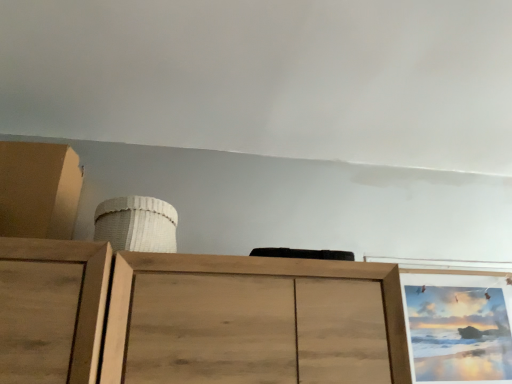
The width and height of the screenshot is (512, 384). What do you see at coordinates (38, 190) in the screenshot?
I see `matte brown cabinet at upper left` at bounding box center [38, 190].

Measure the distance between white woven basket at upper center and camera.

The depth of white woven basket at upper center is 1.29 meters.

This screenshot has width=512, height=384. In order to click on wooden picture frame at upper right in this screenshot , I will do `click(459, 327)`.

How much distance is there between matte brown cabinet at upper left and wooden picture frame at upper right?

matte brown cabinet at upper left and wooden picture frame at upper right are 1.61 meters apart from each other.

Are matte brown cabinet at upper left and wooden picture frame at upper right far apart?

matte brown cabinet at upper left is far away from wooden picture frame at upper right.

Is matte brown cabinet at upper left in front of wooden picture frame at upper right?

Yes, the depth of matte brown cabinet at upper left is less than that of wooden picture frame at upper right.

Between matte brown cabinet at upper left and wooden picture frame at upper right, which one appears on the right side from the viewer's perspective?

wooden picture frame at upper right.

Is white woven basket at upper center wider than matte brown cabinet at upper left?

In fact, white woven basket at upper center might be narrower than matte brown cabinet at upper left.

Which is in front, point (125, 206) or point (21, 187)?

The point (125, 206) is in front.

From the image's perspective, would you say white woven basket at upper center is shown under matte brown cabinet at upper left?

Yes.

Is white woven basket at upper center inside or outside of matte brown cabinet at upper left?

white woven basket at upper center cannot be found inside matte brown cabinet at upper left.

I want to click on cabinetry above the white woven basket at upper center (from the image's perspective), so click(38, 190).

Which is farther from the camera, (47, 144) or (115, 249)?

The point (47, 144) is farther from the camera.

Which object is thinner, matte brown cabinet at upper left or white woven basket at upper center?

Thinner between the two is white woven basket at upper center.

Can we say matte brown cabinet at upper left lies outside white woven basket at upper center?

Yes.

From the image's perspective, between wooden picture frame at upper right and matte brown cabinet at upper left, which one is located above?

matte brown cabinet at upper left appears higher in the image.

Between wooden picture frame at upper right and matte brown cabinet at upper left, which one has larger size?

Bigger between the two is matte brown cabinet at upper left.

Could you tell me if wooden picture frame at upper right is facing matte brown cabinet at upper left?

No, wooden picture frame at upper right is not oriented towards matte brown cabinet at upper left.

In terms of height, does white woven basket at upper center look taller or shorter compared to wooden picture frame at upper right?

In the image, white woven basket at upper center appears to be shorter than wooden picture frame at upper right.

Which is behind, white woven basket at upper center or wooden picture frame at upper right?

wooden picture frame at upper right.

Considering the relative sizes of white woven basket at upper center and wooden picture frame at upper right in the image provided, is white woven basket at upper center wider than wooden picture frame at upper right?

Correct, the width of white woven basket at upper center exceeds that of wooden picture frame at upper right.

Which is behind, point (175, 227) or point (470, 369)?

The point (470, 369) is more distant.

Is wooden picture frame at upper right outside of white woven basket at upper center?

Yes, wooden picture frame at upper right is not within white woven basket at upper center.

Does wooden picture frame at upper right have a greater height compared to white woven basket at upper center?

Indeed, wooden picture frame at upper right has a greater height compared to white woven basket at upper center.

Where is `picture frame below the matte brown cabinet at upper left (from the image's perspective)`? The image size is (512, 384). picture frame below the matte brown cabinet at upper left (from the image's perspective) is located at coordinates (459, 327).

Identify the location of cabinetry that is behind the white woven basket at upper center. The width and height of the screenshot is (512, 384). (38, 190).

Looking at the image, which one is located closer to matte brown cabinet at upper left, white woven basket at upper center or wooden picture frame at upper right?

The object closer to matte brown cabinet at upper left is white woven basket at upper center.

Estimate the real-world distances between objects in this image. Which object is further from wooden picture frame at upper right, white woven basket at upper center or matte brown cabinet at upper left?

matte brown cabinet at upper left lies further to wooden picture frame at upper right than the other object.

Looking at the image, which one is located further to white woven basket at upper center, wooden picture frame at upper right or matte brown cabinet at upper left?

wooden picture frame at upper right is positioned further to the anchor white woven basket at upper center.

When comparing their distances from wooden picture frame at upper right, does matte brown cabinet at upper left or white woven basket at upper center seem closer?

The object closer to wooden picture frame at upper right is white woven basket at upper center.

From the image, which object appears to be farther from white woven basket at upper center, matte brown cabinet at upper left or wooden picture frame at upper right?

Based on the image, wooden picture frame at upper right appears to be further to white woven basket at upper center.

Considering their positions, is wooden picture frame at upper right positioned closer to matte brown cabinet at upper left than white woven basket at upper center?

Based on the image, white woven basket at upper center appears to be nearer to matte brown cabinet at upper left.

Find the location of a particular element. job between matte brown cabinet at upper left and wooden picture frame at upper right in the horizontal direction is located at coordinates (136, 224).